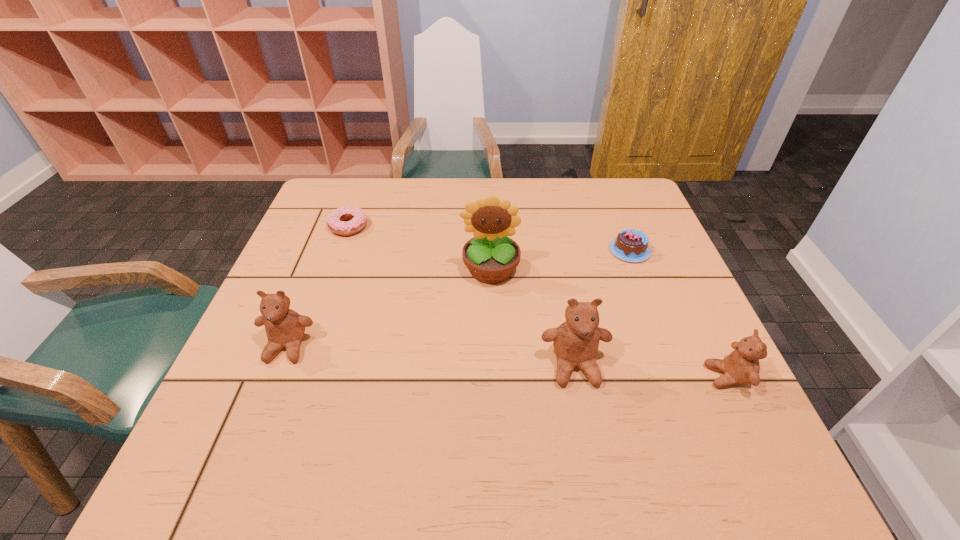
Locate an element on the screen. free space at the far right corner is located at coordinates (627, 212).

The width and height of the screenshot is (960, 540). Find the location of `free space at the near right corner of the desktop`. free space at the near right corner of the desktop is located at coordinates (708, 406).

Identify the location of vacant area that lies between the chocolate cake and the sunflower. (560, 260).

Find the location of a particular element. free point between the fourth object from right to left and the second object from right to left is located at coordinates coord(560,260).

Where is `free space between the third tallest object and the shortest teddy bear`? This screenshot has width=960, height=540. free space between the third tallest object and the shortest teddy bear is located at coordinates (507, 362).

Find the location of a particular element. free space between the leftmost teddy bear and the tallest object is located at coordinates (389, 308).

You are a GUI agent. You are given a task and a screenshot of the screen. Output one action in this format:
    pyautogui.click(x=<x>, y=<y>)
    Task: Click on the vacant area that lies between the fourth object from right to left and the rightmost teddy bear
    This screenshot has height=540, width=960.
    Given the screenshot: What is the action you would take?
    pyautogui.click(x=609, y=323)

At what (x,y) coordinates should I click in order to perform the action: click on vacant space that's between the doughnut and the shortest teddy bear. Please return your answer as a coordinate pair (x, y). Image resolution: width=960 pixels, height=540 pixels. Looking at the image, I should click on (538, 301).

Find the location of a particular element. This screenshot has width=960, height=540. free area in between the chocolate cake and the second teddy bear from left to right is located at coordinates pyautogui.click(x=602, y=308).

Identify the location of unoccupied area between the fourth tallest object and the second teddy bear from left to right. This screenshot has height=540, width=960. click(x=651, y=371).